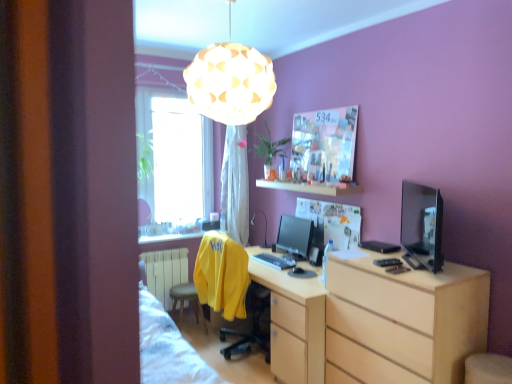
The image size is (512, 384). I want to click on vacant area to the right of white plastic keyboard at center, so click(296, 259).